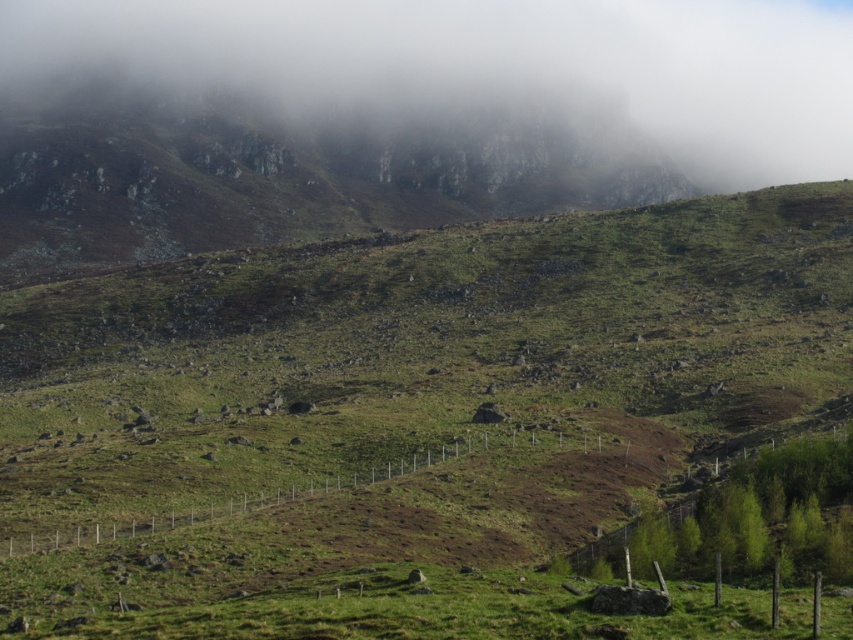
You are standing at the base of the mountain and see two points marked on the terrain. The first is at coordinate point [334,97] and the second at point [347,150]. Which point is closer to your current position?

Point [334,97] is further to the camera than point [347,150], so the point closer to your current position is point [347,150].

You are a hiker planning to cross the green grassy field at lower center. There is a foggy rock formation at upper center in the distance. Which direction should you head to reach the rock formation?

You should head upwards from the green grassy field at lower center to reach the foggy rock formation at upper center since it is located above the field.

You are standing at the center of the image and want to locate the rocky gray mountain at upper left. According to the coordinates provided, in which direction should you look to find it?

The rocky gray mountain at upper left is located at coordinates point (x=274, y=177), so you should look to the upper left direction to find it.